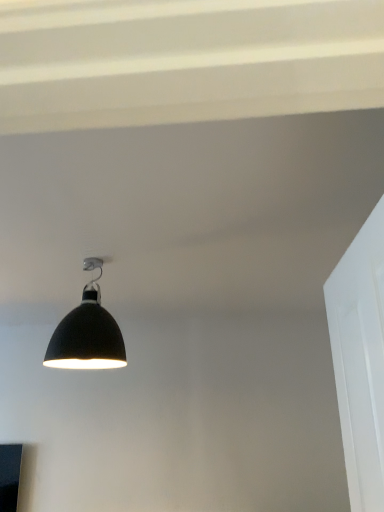
Measure the distance between matte black lampshade at upper center and camera.

matte black lampshade at upper center is 1.94 meters from camera.

Locate an element on the screen. This screenshot has height=512, width=384. matte black lampshade at upper center is located at coordinates (87, 332).

Describe the element at coordinates (87, 332) in the screenshot. This screenshot has width=384, height=512. I see `matte black lampshade at upper center` at that location.

Find the location of a particular element. This screenshot has height=512, width=384. matte black lampshade at upper center is located at coordinates (87, 332).